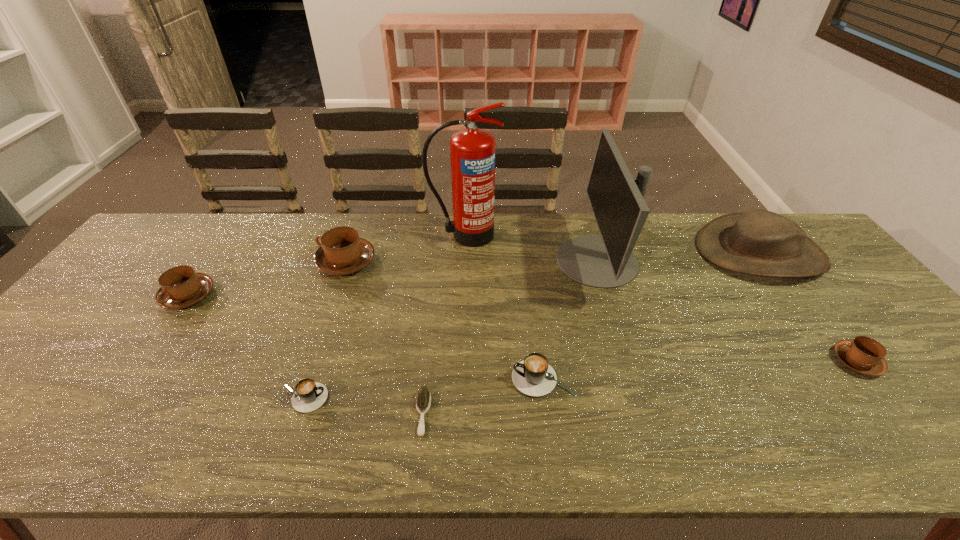
The width and height of the screenshot is (960, 540). What are the coordinates of `vacant space that is in between the computer monitor and the shortest cappuccino` in the screenshot? It's located at (450, 329).

The height and width of the screenshot is (540, 960). Find the location of `vacant point located between the second tallest object and the rightmost brown cappuccino`. vacant point located between the second tallest object and the rightmost brown cappuccino is located at coordinates (727, 311).

Locate an element on the screen. This screenshot has height=540, width=960. free space that is in between the tallest cappuccino and the leftmost object is located at coordinates (267, 279).

Locate an element on the screen. The image size is (960, 540). vacant area that lies between the leftmost cappuccino and the bigger black cappuccino is located at coordinates (366, 337).

This screenshot has height=540, width=960. Find the location of `vacant area that lies between the shortest cappuccino and the rightmost brown cappuccino`. vacant area that lies between the shortest cappuccino and the rightmost brown cappuccino is located at coordinates (x=580, y=380).

Locate an element on the screen. the seventh closest object relative to the second tallest object is located at coordinates (309, 395).

Locate which object ranks fifth in proximity to the computer monitor. Please provide its 2D coordinates. Your answer should be formatted as a tuple, i.e. [(x, y)], where the tuple contains the x and y coordinates of a point satisfying the conditions above.

[(423, 401)]

Locate an element on the screen. cappuccino that can be found as the second closest to the gray computer monitor is located at coordinates (864, 355).

Locate an element on the screen. The width and height of the screenshot is (960, 540). cappuccino that stands as the second closest to the cowboy hat is located at coordinates (533, 376).

Identify which brown cappuccino is the second closest to the second brown cappuccino from right to left. Please provide its 2D coordinates. Your answer should be formatted as a tuple, i.e. [(x, y)], where the tuple contains the x and y coordinates of a point satisfying the conditions above.

[(864, 355)]